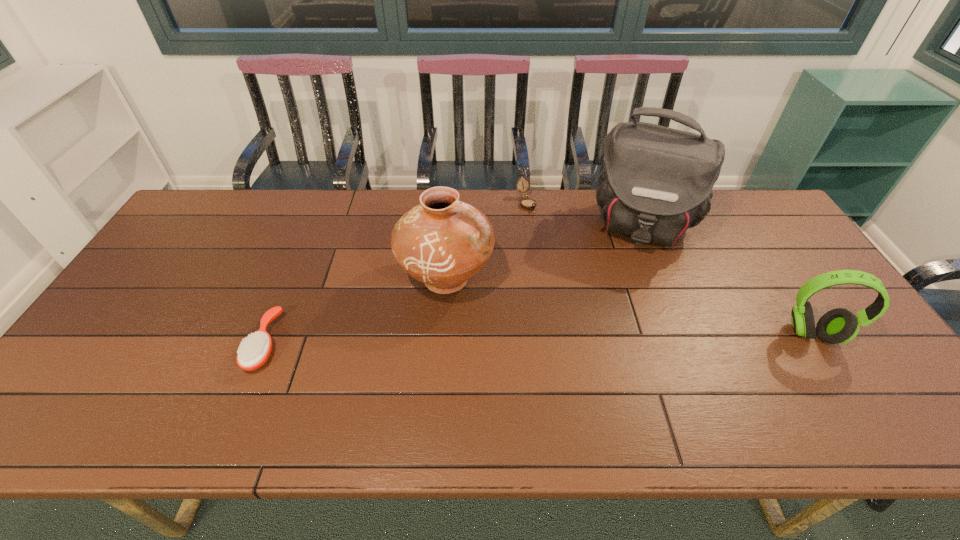
I want to click on free space located on the open flap of the shoulder bag, so click(626, 298).

Identify the location of compass located at the far edge. Image resolution: width=960 pixels, height=540 pixels. [527, 203].

I want to click on shoulder bag at the far edge, so click(x=656, y=182).

The height and width of the screenshot is (540, 960). What are the coordinates of `object that is at the near edge` in the screenshot? It's located at (253, 353).

Where is `object at the right edge`? Image resolution: width=960 pixels, height=540 pixels. object at the right edge is located at coordinates (838, 326).

This screenshot has height=540, width=960. Find the location of `free space at the far edge of the desktop`. free space at the far edge of the desktop is located at coordinates (302, 194).

In the image, there is a desktop. Where is `free region at the near edge`? This screenshot has width=960, height=540. free region at the near edge is located at coordinates (654, 369).

Find the location of a particular element. vacant space at the left edge of the desktop is located at coordinates (134, 336).

Identify the location of free region at the right edge of the desktop. The image size is (960, 540). (835, 350).

This screenshot has width=960, height=540. What are the coordinates of `vacant space in between the hairbrush and the fourth tallest object` in the screenshot? It's located at (396, 273).